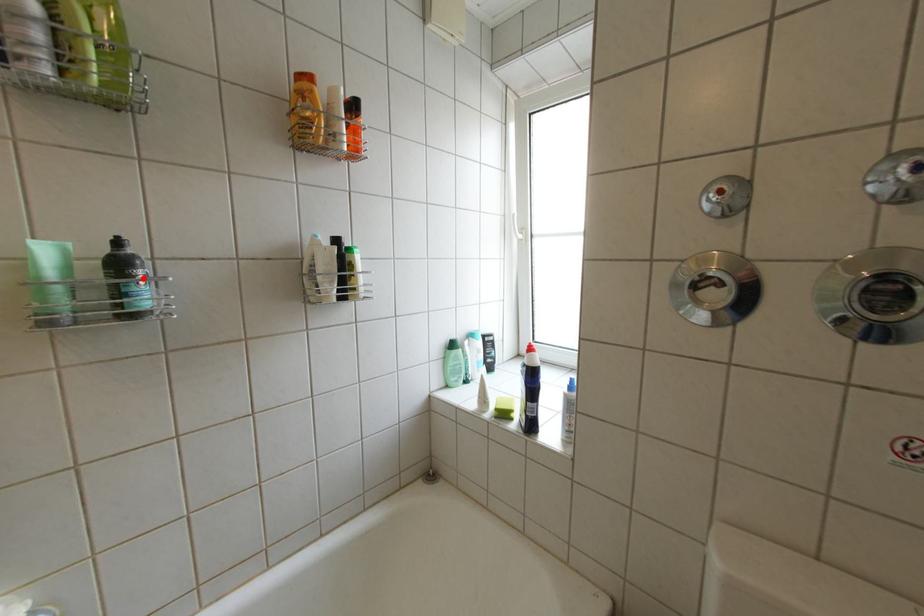
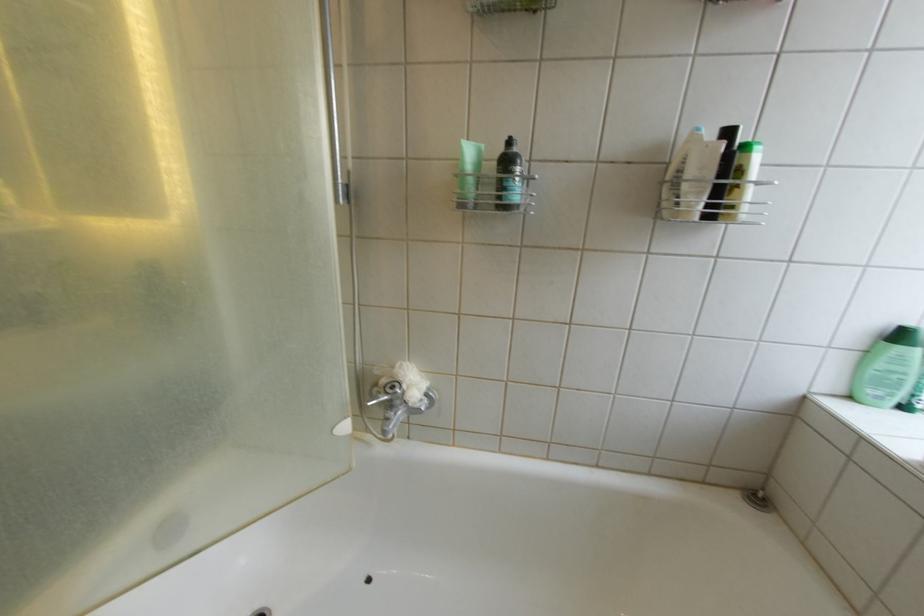
In the second image, find the point that corresponds to the highlighted location in the first image.

(524, 174)